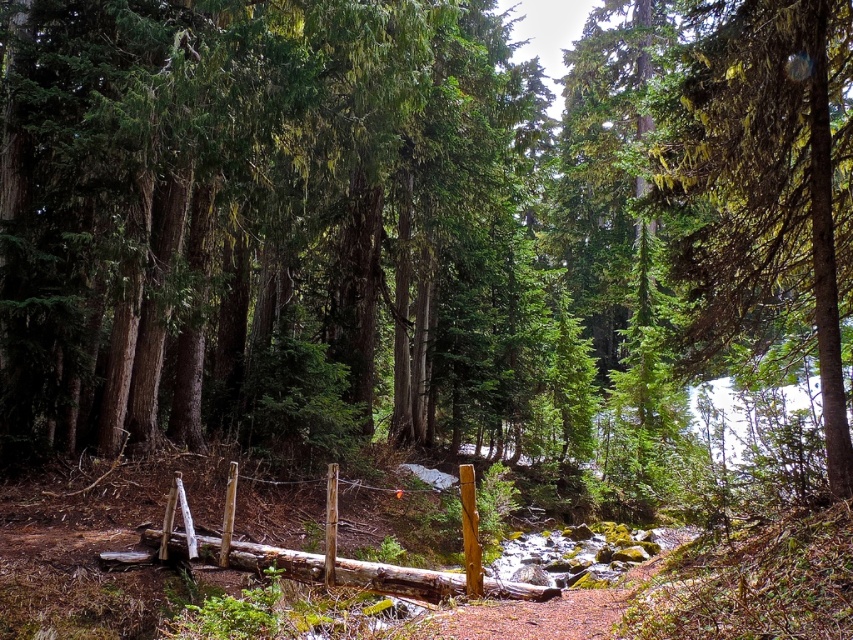
You are a hiker carrying a backpack and need to cross the stream. The green mossy tree at upper right and the natural wood log at center are landmarks. How far apart are these two landmarks?

The green mossy tree at upper right is 4.45 meters away from the natural wood log at center.

You are standing on the rustic wooden bridge in the forest. You notice two points marked in the scene. Which point, point (704, 308) or point (183, 499), is closer to you?

Point (704, 308) is further to the viewer than point (183, 499), so the closer point is point (183, 499).